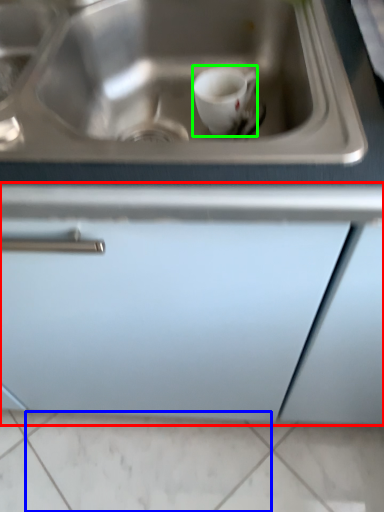
Question: Which is farther away from cabinetry (highlighted by a red box)? tile (highlighted by a blue box) or coffee cup (highlighted by a green box)?

Choices:
 (A) tile
 (B) coffee cup

Answer: (A)